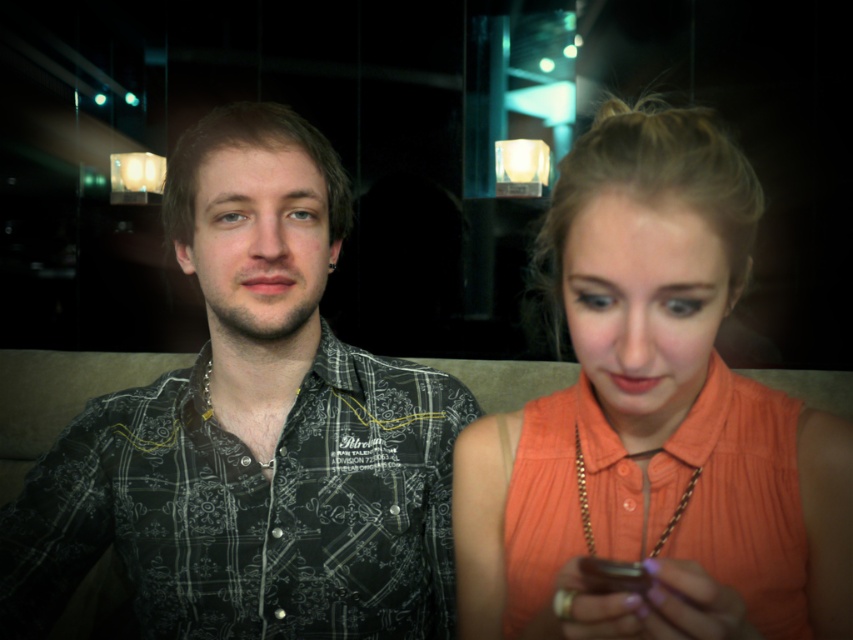
Question: Based on their relative distances, which object is farther from the orange fabric shirt at center?

Choices:
 (A) patterned shirt at left
 (B) orange satin shirt at lower right

Answer: (A)

Question: Considering the relative positions of patterned shirt at left and orange fabric shirt at center in the image provided, where is patterned shirt at left located with respect to orange fabric shirt at center?

Choices:
 (A) right
 (B) left

Answer: (B)

Question: Which of the following is the closest to the observer?

Choices:
 (A) (239, 278)
 (B) (618, 333)

Answer: (B)

Question: Does patterned shirt at left appear on the left side of orange fabric shirt at center?

Choices:
 (A) no
 (B) yes

Answer: (B)

Question: Which object is positioned closest to the orange satin shirt at lower right?

Choices:
 (A) orange fabric shirt at center
 (B) patterned shirt at left

Answer: (A)

Question: Can you confirm if patterned shirt at left is positioned to the left of orange satin shirt at lower right?

Choices:
 (A) no
 (B) yes

Answer: (B)